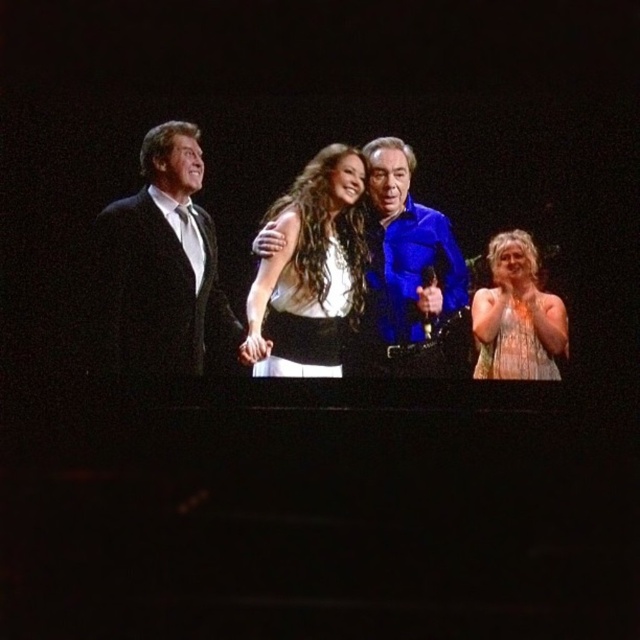
Question: Among these objects, which one is nearest to the camera?

Choices:
 (A) white satin dress at center
 (B) black satin dress at center
 (C) white lace dress at lower right
 (D) black satin suit at left

Answer: (B)

Question: Observing the image, what is the correct spatial positioning of black satin suit at left in reference to black satin dress at center?

Choices:
 (A) below
 (B) above

Answer: (B)

Question: Observing the image, what is the correct spatial positioning of white satin dress at center in reference to white lace dress at lower right?

Choices:
 (A) below
 (B) above

Answer: (B)

Question: Which point is farther to the camera?

Choices:
 (A) (170, 260)
 (B) (308, 211)
 (C) (509, 243)
 (D) (291, 337)

Answer: (C)

Question: Which object is positioned farthest from the black satin dress at center?

Choices:
 (A) white satin dress at center
 (B) black satin suit at left

Answer: (B)

Question: From the image, what is the correct spatial relationship of black satin suit at left in relation to black satin dress at center?

Choices:
 (A) below
 (B) above

Answer: (B)